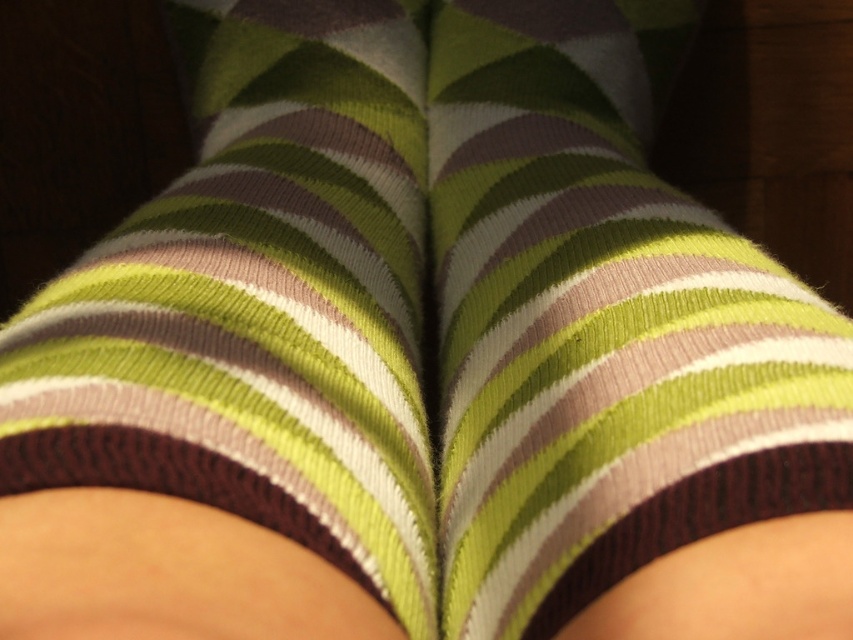
Which is above, knit green striped sock at center or knitted green and brown striped sock at center?

knitted green and brown striped sock at center

You are a GUI agent. You are given a task and a screenshot of the screen. Output one action in this format:
    pyautogui.click(x=<x>, y=<y>)
    Task: Click on the knit green striped sock at center
    This screenshot has width=853, height=640.
    Given the screenshot: What is the action you would take?
    pyautogui.click(x=599, y=324)